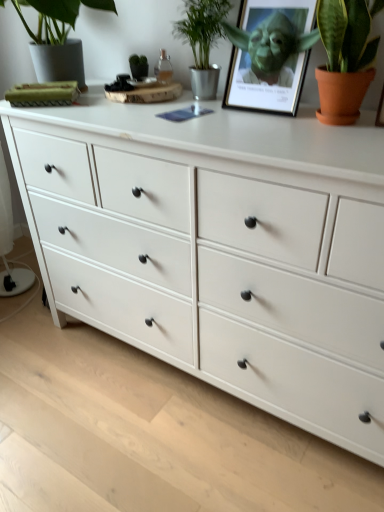
At what (x,y) coordinates should I click in order to perform the action: click on vacant space in front of green metallic plant at upper center, arranged as the second houseplant when viewed from the right. Please return your answer as a coordinate pair (x, y). Looking at the image, I should click on [x=192, y=112].